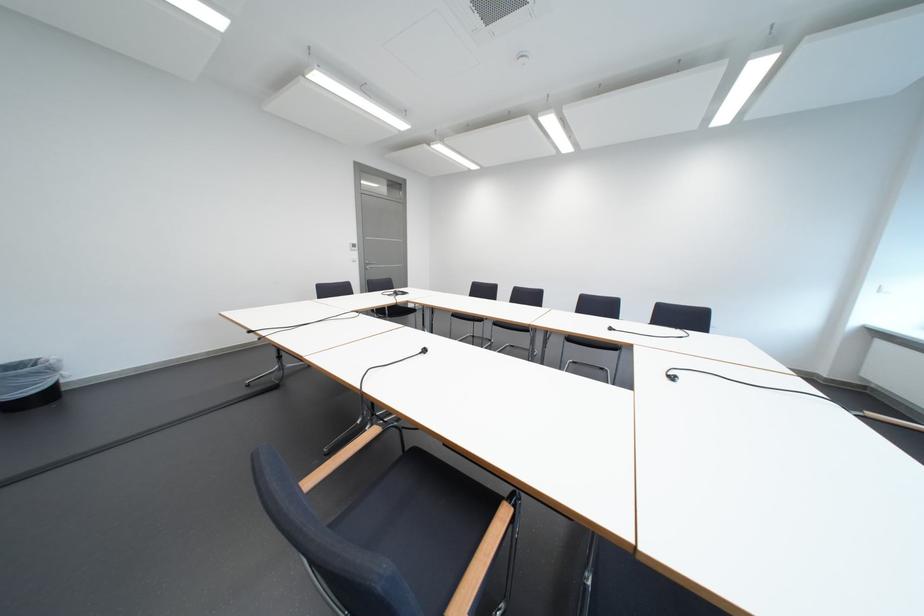
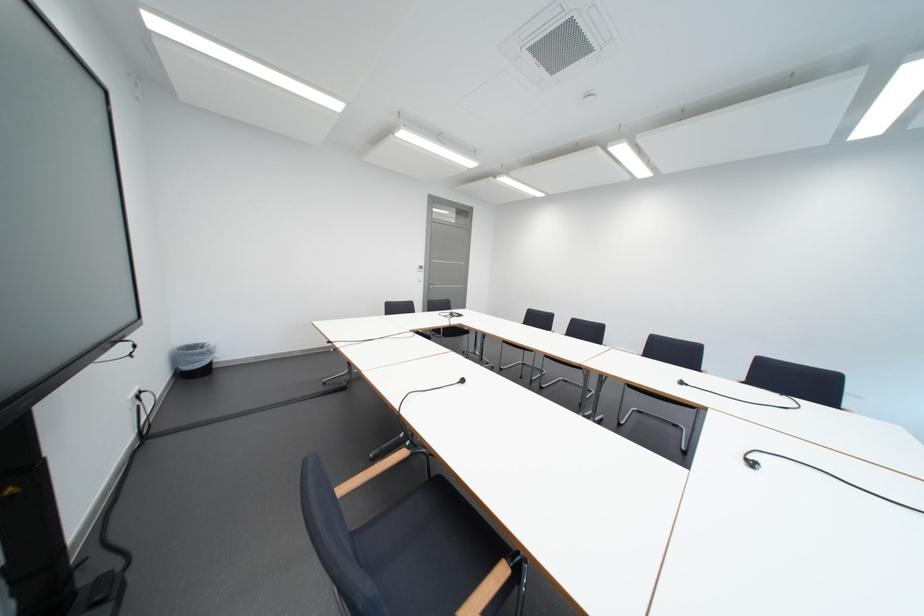
What movement of the cameraman would produce the second image?

The movement direction of the cameraman is right, backward.